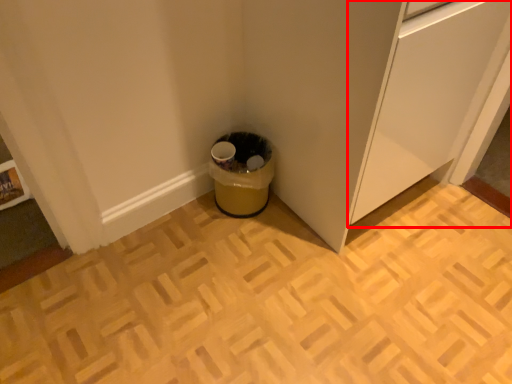
Question: From the image's perspective, where is cabinetry (annotated by the red box) located relative to waste container?

Choices:
 (A) above
 (B) below

Answer: (A)